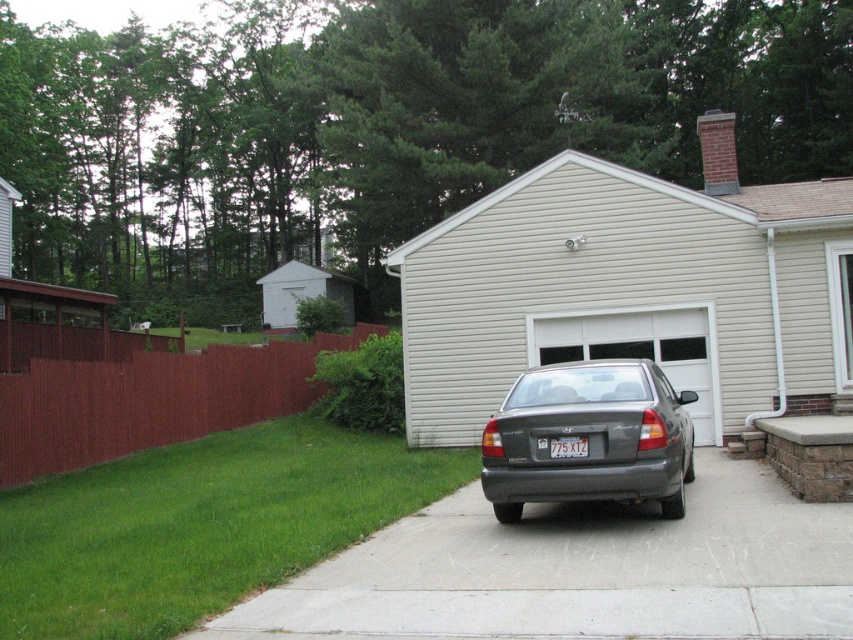
Is gray concrete pavement at center wider than brown wood fence at left?

No.

Can you confirm if gray concrete pavement at center is positioned to the left of brown wood fence at left?

Incorrect, gray concrete pavement at center is not on the left side of brown wood fence at left.

Does point (308, 620) come farther from viewer compared to point (38, 445)?

No, it is not.

Locate an element on the screen. gray concrete pavement at center is located at coordinates (581, 570).

Can you confirm if white siding garage at center is positioned to the right of white plastic license plate at center?

Correct, you'll find white siding garage at center to the right of white plastic license plate at center.

The width and height of the screenshot is (853, 640). I want to click on white siding garage at center, so click(x=631, y=289).

Does point (497, 353) come closer to viewer compared to point (579, 456)?

No, (497, 353) is further to viewer.

The width and height of the screenshot is (853, 640). I want to click on white siding garage at center, so click(631, 289).

Based on the photo, is brown wood fence at left shorter than satin gray sedan at center?

No, brown wood fence at left is not shorter than satin gray sedan at center.

Find the location of a particular element. Image resolution: width=853 pixels, height=640 pixels. brown wood fence at left is located at coordinates (149, 401).

Image resolution: width=853 pixels, height=640 pixels. What do you see at coordinates (149, 401) in the screenshot? I see `brown wood fence at left` at bounding box center [149, 401].

The width and height of the screenshot is (853, 640). In order to click on brown wood fence at left in this screenshot , I will do `click(149, 401)`.